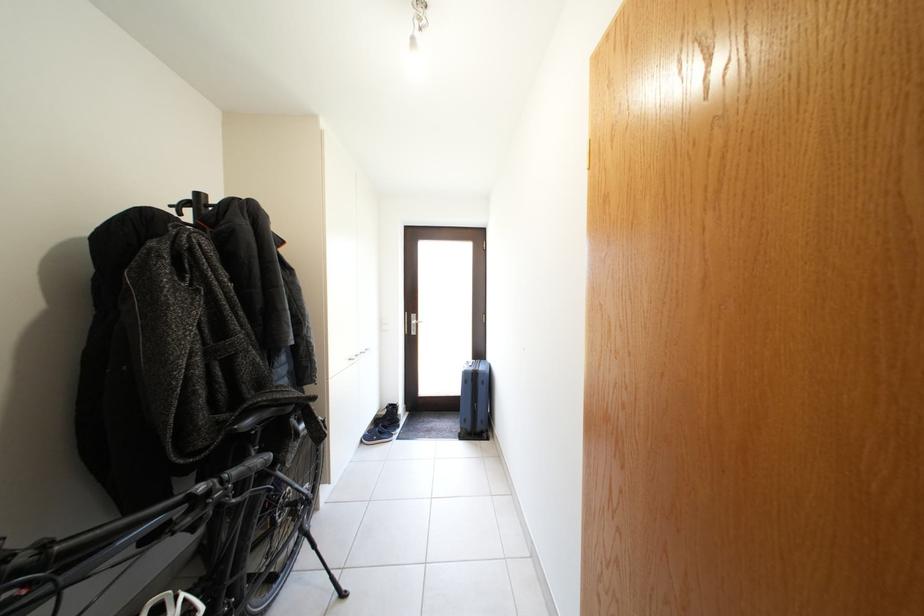
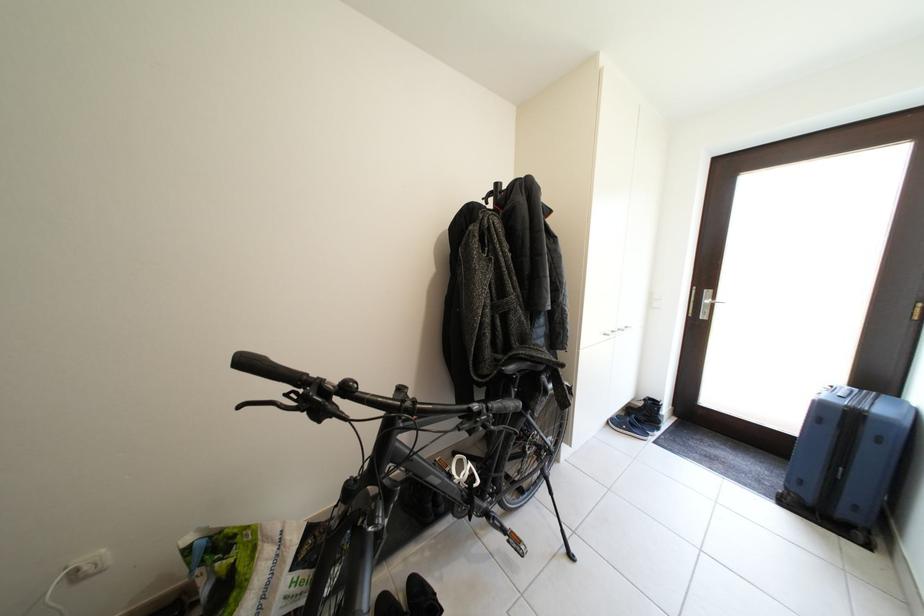
Question: How did the camera likely rotate?

Choices:
 (A) Left
 (B) Right
 (C) Up
 (D) Down

Answer: (A)